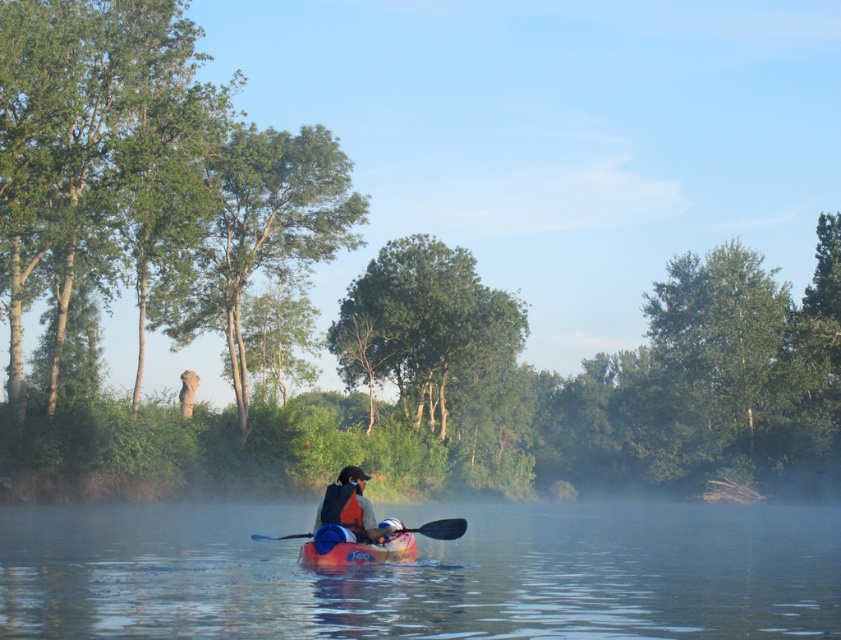
You are a drone operator trying to capture a photo of the green leafy tree at left from above. Given the coordinates provided in the Objects Description, can you confirm if the tree is positioned in the upper half of the image?

The green leafy tree at left is located at point [93,152]. Since the y coordinate 0.112 is below 0.5, the tree is positioned in the lower half of the image, so it won not be in the upper half.